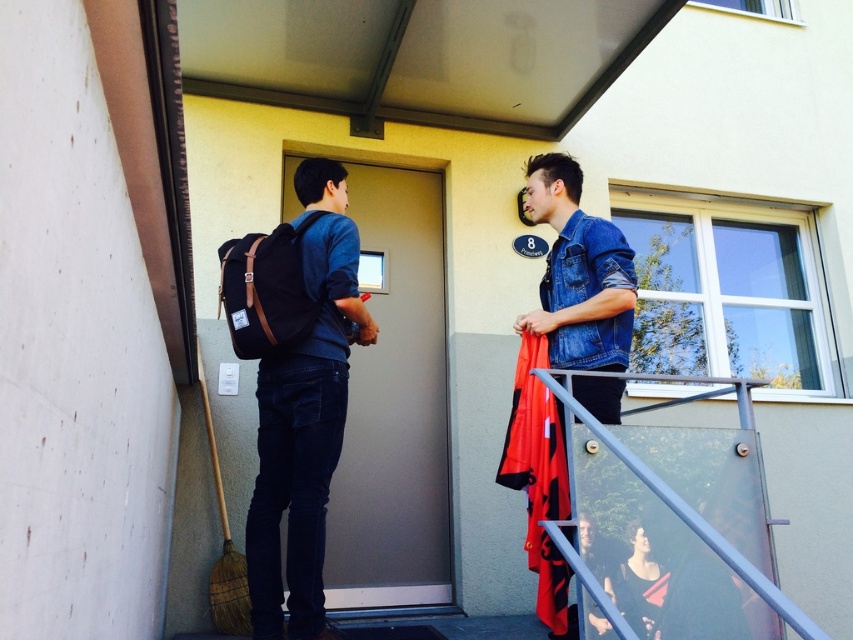
Question: Is the position of matte black backpack at left more distant than that of denim jacket at upper right?

Choices:
 (A) no
 (B) yes

Answer: (B)

Question: Does matte black backpack at left have a larger size compared to denim jacket at upper right?

Choices:
 (A) no
 (B) yes

Answer: (A)

Question: Which object is farther from the camera taking this photo?

Choices:
 (A) matte black backpack at left
 (B) denim jacket at upper right

Answer: (A)

Question: Where is matte black backpack at left located in relation to denim jacket at upper right in the image?

Choices:
 (A) above
 (B) below

Answer: (B)